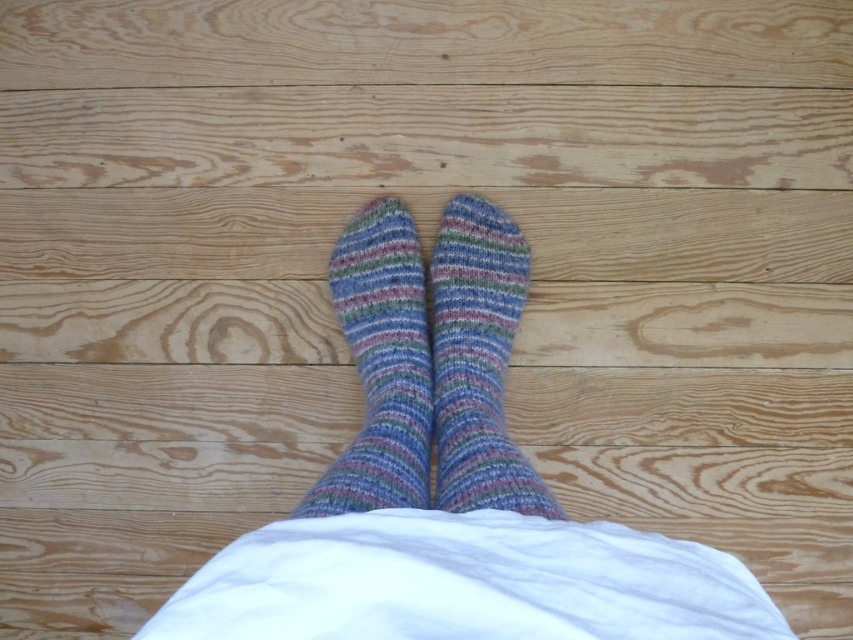
You are designing a display for a sock shop and need to arrange the multicolored knitted sock at center and the multicolored knitted socks at center on a shelf. Which one should you place on the left side if you want the narrower item to be on the left?

The multicolored knitted sock at center has a smaller width than the multicolored knitted socks at center, so you should place the multicolored knitted sock at center on the left side to have the narrower item there.

You are a photographer setting up a shoot focusing on the multicolored knitted sock at center and the multicolored knitted socks at center. To ensure proper lighting, you need to know their vertical positions. Which one is higher?

The multicolored knitted sock at center is located above the multicolored knitted socks at center, so it is higher.

You are organizing a sock display and need to arrange the multicolored knitted sock at center and the multicolored knitted socks at center based on their height. Which one should be placed higher up on the shelf?

The multicolored knitted sock at center should be placed higher up on the shelf because it has a greater height compared to the multicolored knitted socks at center.